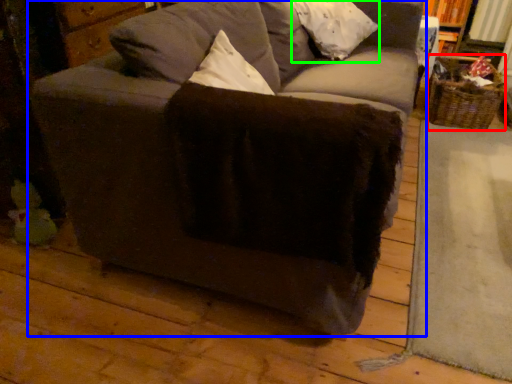
Question: Which object is the closest to the basket (highlighted by a red box)? Choose among these: studio couch (highlighted by a blue box) or pillow (highlighted by a green box).

Choices:
 (A) studio couch
 (B) pillow

Answer: (B)